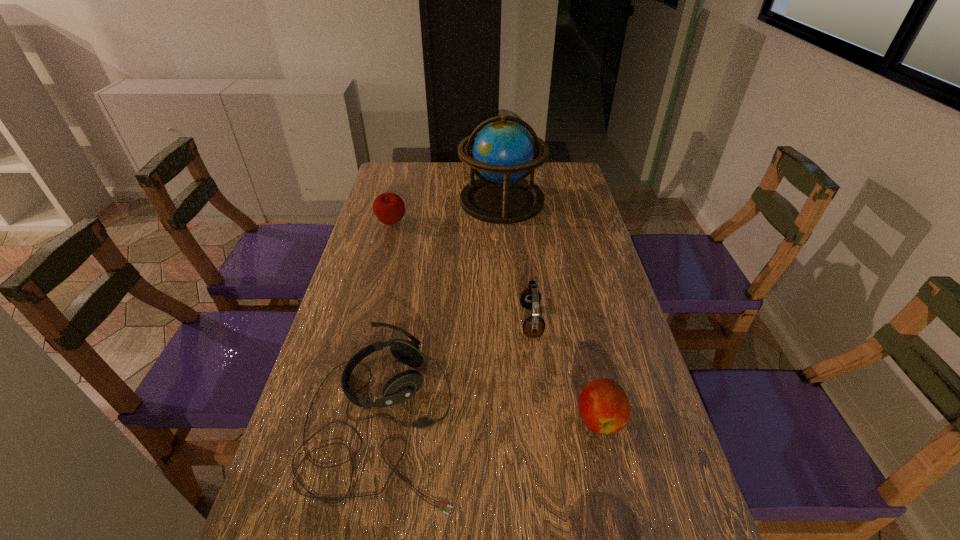
Locate an element on the screen. Image resolution: width=960 pixels, height=540 pixels. vacant space that satisfies the following two spatial constraints: 1. on the back side of the globe; 2. on the right side of the farther apple is located at coordinates (397, 200).

You are a GUI agent. You are given a task and a screenshot of the screen. Output one action in this format:
    pyautogui.click(x=<x>, y=<y>)
    Task: Click on the vacant space that satisfies the following two spatial constraints: 1. on the front side of the right apple; 2. on the right side of the left apple
    
    Given the screenshot: What is the action you would take?
    pyautogui.click(x=339, y=418)

Identify the location of vacant region that satisfies the following two spatial constraints: 1. on the ear cups of the farther headset; 2. on the right side of the nearer apple. This screenshot has height=540, width=960. (542, 418).

Where is `vacant space that satisfies the following two spatial constraints: 1. on the outer surface of the nearer headset; 2. on the right side of the right apple`? The image size is (960, 540). vacant space that satisfies the following two spatial constraints: 1. on the outer surface of the nearer headset; 2. on the right side of the right apple is located at coordinates (382, 418).